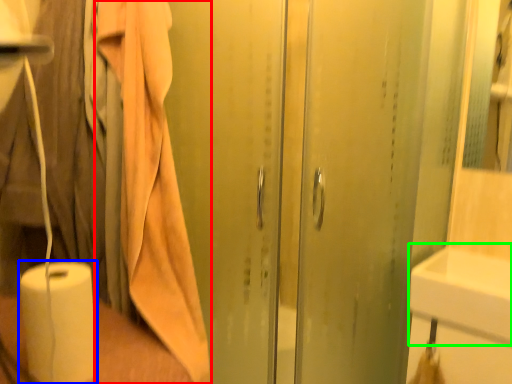
Question: Considering the real-world distances, which object is closest to bath towel (highlighted by a red box)? paper towel (highlighted by a blue box) or sink (highlighted by a green box).

Choices:
 (A) paper towel
 (B) sink

Answer: (A)